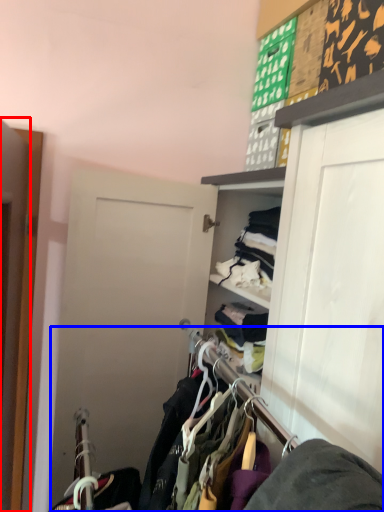
Question: Which of the following is the closest to the observer, door (highlighted by a red box) or closet (highlighted by a blue box)?

Choices:
 (A) door
 (B) closet

Answer: (B)